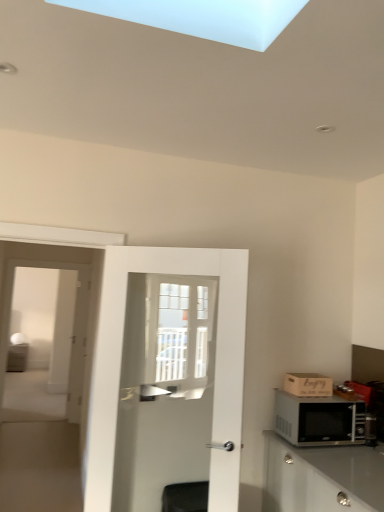
This screenshot has height=512, width=384. What do you see at coordinates (308, 385) in the screenshot? I see `wooden crate at right` at bounding box center [308, 385].

The width and height of the screenshot is (384, 512). What are the coordinates of `wooden crate at right` in the screenshot? It's located at (308, 385).

This screenshot has width=384, height=512. Find the location of `wooden crate at right`. wooden crate at right is located at coordinates (308, 385).

Which object is positioned more to the left, white glass screen door at left or wooden crate at right?

Positioned to the left is white glass screen door at left.

Is wooden crate at right a part of white glass screen door at left?

No, wooden crate at right is not inside white glass screen door at left.

From a real-world perspective, who is located higher, white glass screen door at left or wooden crate at right?

white glass screen door at left.

Would you consider white glass screen door at left to be distant from wooden crate at right?

Yes, white glass screen door at left is far from wooden crate at right.

Considering the positions of points (17, 347) and (328, 432), is point (17, 347) farther from camera compared to point (328, 432)?

Yes.

In the scene shown: In terms of width, does matte white cabinet at left look wider or thinner when compared to black metallic microwave at right?

matte white cabinet at left is wider than black metallic microwave at right.

From the picture: Is white glossy door at center oriented towards white glass screen door at left?

No, white glossy door at center is not turned towards white glass screen door at left.

Which is closer to the camera, (232, 511) or (57, 424)?

Clearly, point (232, 511) is closer to the camera than point (57, 424).

In the image, there is a white glossy door at center. Identify the location of screen door above it (from the image's perspective). The height and width of the screenshot is (512, 384). pyautogui.click(x=38, y=463).

Is white glass screen door at left positioned before matte white cabinet at left?

Yes, it is.

Consider the image. From the image's perspective, which one is positioned lower, white glass screen door at left or matte white cabinet at left?

matte white cabinet at left is shown below in the image.

Between point (66, 456) and point (23, 353), which one is positioned behind?

Positioned behind is point (23, 353).

From a real-world perspective, who is located higher, white glass screen door at left or matte white cabinet at left?

white glass screen door at left.

From the image's perspective, which object appears higher, wooden crate at right or black metallic microwave at right?

wooden crate at right, from the image's perspective.

Which of these two, wooden crate at right or black metallic microwave at right, is wider?

Wider between the two is black metallic microwave at right.

Choose the correct answer: Is wooden crate at right inside black metallic microwave at right or outside it?

wooden crate at right is spatially situated outside black metallic microwave at right.

Is wooden crate at right turned away from black metallic microwave at right?

wooden crate at right does not have its back to black metallic microwave at right.

Considering the points (219, 474) and (8, 362), which point is behind, point (219, 474) or point (8, 362)?

The point (8, 362) is farther.

Looking at their sizes, would you say white glossy door at center is wider or thinner than matte white cabinet at left?

Clearly, white glossy door at center has less width compared to matte white cabinet at left.

From a real-world perspective, which object stands above the other?

white glossy door at center.

How many degrees apart are the facing directions of white glossy door at center and matte white cabinet at left?

The facing directions of white glossy door at center and matte white cabinet at left are 31 degrees apart.

Which of these two, matte white cabinet at left or wooden crate at right, stands shorter?

With less height is wooden crate at right.

Considering the relative sizes of matte white cabinet at left and wooden crate at right in the image provided, is matte white cabinet at left smaller than wooden crate at right?

Incorrect, matte white cabinet at left is not smaller in size than wooden crate at right.

From the image's perspective, which one is positioned higher, matte white cabinet at left or wooden crate at right?

wooden crate at right is shown above in the image.

The width and height of the screenshot is (384, 512). I want to click on cardboard box on the right of white glass screen door at left, so click(x=308, y=385).

Find the location of a particular element. microwave oven located above the matte white cabinet at left (from a real-world perspective) is located at coordinates (319, 420).

When comparing their distances from black metallic microwave at right, does white glossy door at center or wooden crate at right seem further?

Among the two, white glossy door at center is located further to black metallic microwave at right.

Based on their spatial positions, is white glossy door at center or black metallic microwave at right further from matte white cabinet at left?

The object further to matte white cabinet at left is black metallic microwave at right.

From the image, which object appears to be farther from black metallic microwave at right, matte white cabinet at left or wooden crate at right?

The object further to black metallic microwave at right is matte white cabinet at left.

Based on their spatial positions, is matte white cabinet at left or black metallic microwave at right closer to white glossy door at center?

black metallic microwave at right.

When comparing their distances from white glossy door at center, does white glass screen door at left or matte white cabinet at left seem further?

matte white cabinet at left is positioned further to the anchor white glossy door at center.

Considering their positions, is black metallic microwave at right positioned further to wooden crate at right than matte white cabinet at left?

matte white cabinet at left lies further to wooden crate at right than the other object.

Based on their spatial positions, is white glossy door at center or matte white cabinet at left further from wooden crate at right?

matte white cabinet at left is positioned further to the anchor wooden crate at right.

Considering their positions, is white glass screen door at left positioned further to black metallic microwave at right than white glossy door at center?

The object further to black metallic microwave at right is white glass screen door at left.

You are a GUI agent. You are given a task and a screenshot of the screen. Output one action in this format:
    pyautogui.click(x=<x>, y=<y>)
    Task: Click on the cardboard box between white glass screen door at left and matte white cabinet at left from front to back
    
    Given the screenshot: What is the action you would take?
    pyautogui.click(x=308, y=385)

You are a GUI agent. You are given a task and a screenshot of the screen. Output one action in this format:
    pyautogui.click(x=<x>, y=<y>)
    Task: Click on the microwave oven between white glossy door at center and matte white cabinet at left from front to back
    
    Given the screenshot: What is the action you would take?
    pyautogui.click(x=319, y=420)

Identify the location of cardboard box located between white glossy door at center and black metallic microwave at right in the left-right direction. This screenshot has width=384, height=512. (308, 385).

Image resolution: width=384 pixels, height=512 pixels. Find the location of `cardboard box between black metallic microwave at right and matte white cabinet at left in the front-back direction`. cardboard box between black metallic microwave at right and matte white cabinet at left in the front-back direction is located at coordinates [x=308, y=385].